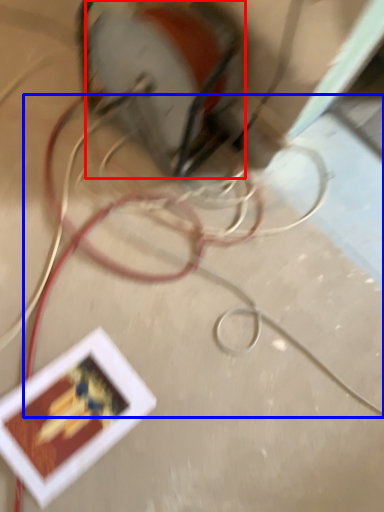
Question: Which point is further to the camera, power plugs and sockets (highlighted by a red box) or wire (highlighted by a blue box)?

Choices:
 (A) power plugs and sockets
 (B) wire

Answer: (A)